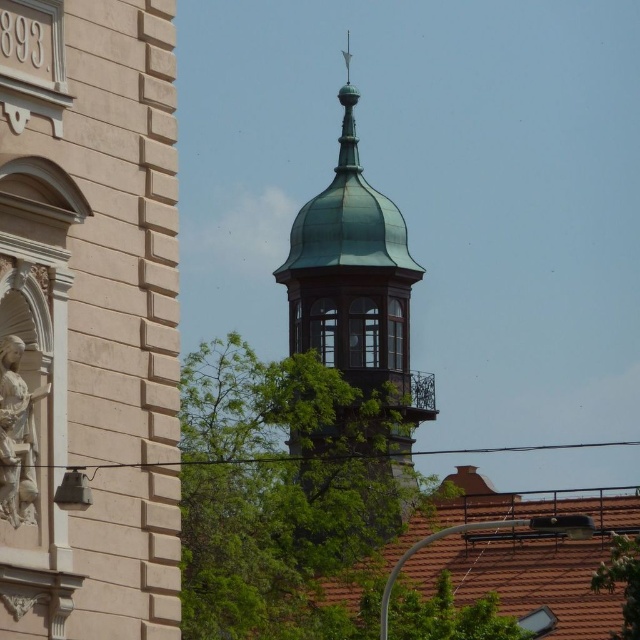
Can you confirm if green copper dome at upper center is positioned below white marble statue at left?

Incorrect, green copper dome at upper center is not positioned below white marble statue at left.

Between green copper dome at upper center and white marble statue at left, which one is positioned higher?

green copper dome at upper center is higher up.

Find the location of a particular element. Image resolution: width=640 pixels, height=640 pixels. green copper dome at upper center is located at coordinates (355, 282).

This screenshot has width=640, height=640. Identify the location of green copper dome at upper center. (355, 282).

Does matte beige church at left come behind white marble statue at left?

No, matte beige church at left is in front of white marble statue at left.

Is point (124, 211) farther from camera compared to point (26, 496)?

That is True.

Where is `matte beige church at left`? The height and width of the screenshot is (640, 640). matte beige church at left is located at coordinates [x=88, y=321].

Is the position of matte beige church at left less distant than that of green copper dome at upper center?

Yes, matte beige church at left is in front of green copper dome at upper center.

Is matte beige church at left positioned behind green copper dome at upper center?

No, matte beige church at left is in front of green copper dome at upper center.

Is point (93, 150) more distant than point (381, 216)?

No, it is in front of (381, 216).

Find the location of a particular element. The height and width of the screenshot is (640, 640). matte beige church at left is located at coordinates (88, 321).